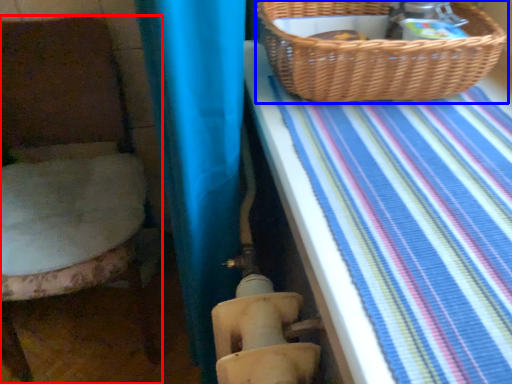
Question: Which of the following is the closest to the observer, furniture (highlighted by a red box) or picnic basket (highlighted by a blue box)?

Choices:
 (A) furniture
 (B) picnic basket

Answer: (B)